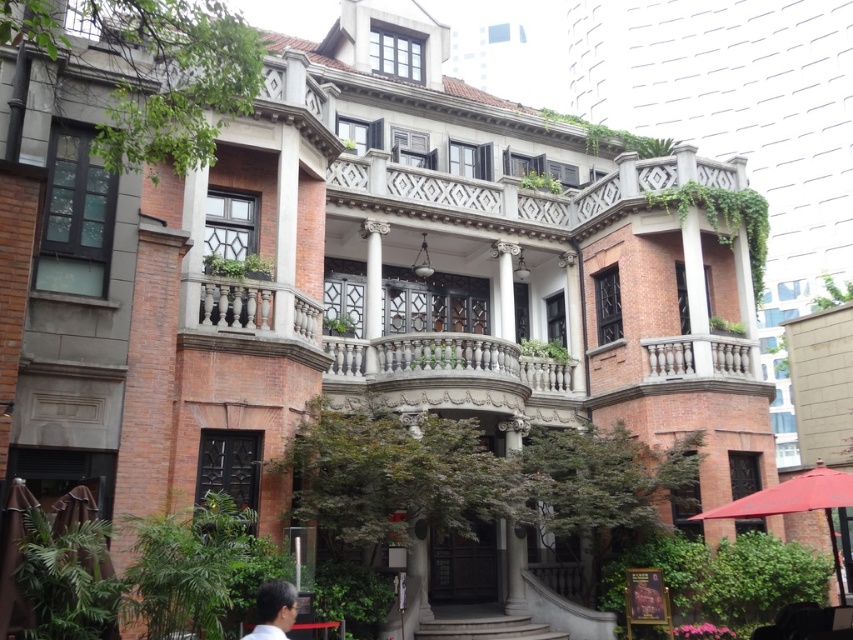
Who is more distant from viewer, (514, 422) or (294, 586)?

The point (514, 422) is behind.

Is point (511, 547) less distant than point (281, 636)?

No, (511, 547) is behind (281, 636).

Identify the location of white marble column at center. This screenshot has height=640, width=853. 515,570.